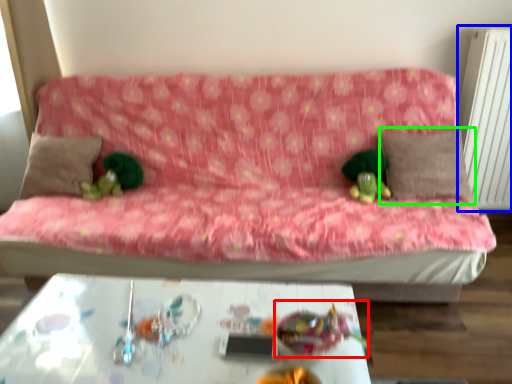
Question: Which object is the farthest from toy (highlighted by a red box)? Choose among these: radiator (highlighted by a blue box) or pillow (highlighted by a green box).

Choices:
 (A) radiator
 (B) pillow

Answer: (A)